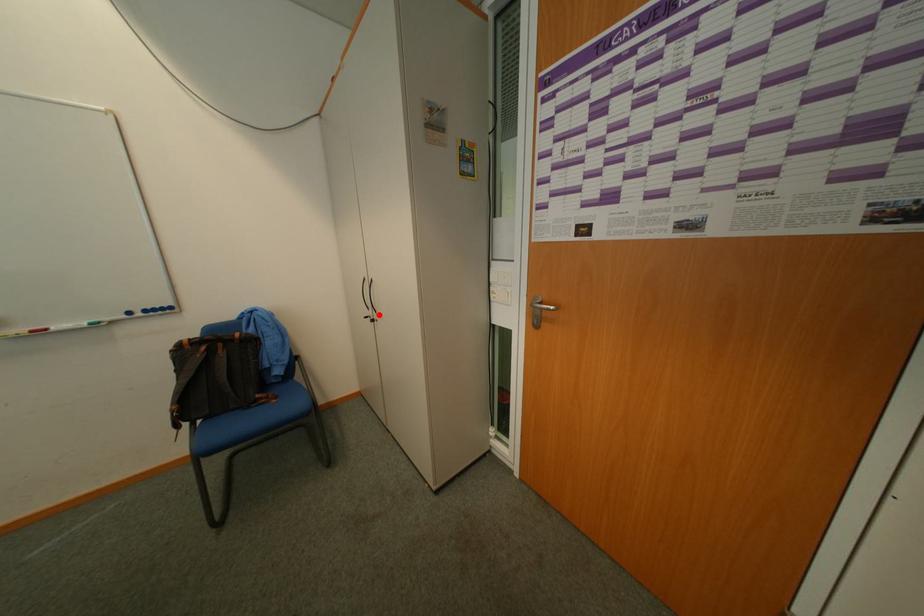
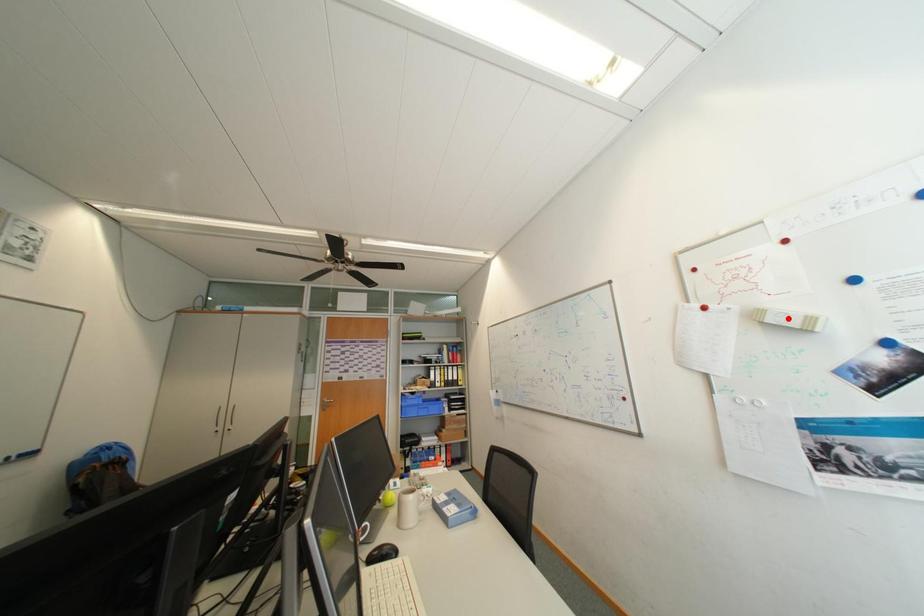
I am providing you with two images of the same scene from different viewpoints. A red point is marked on the first image and another point is marked on the second image. Do the highlighted points in image1 and image2 indicate the same real-world spot?

No